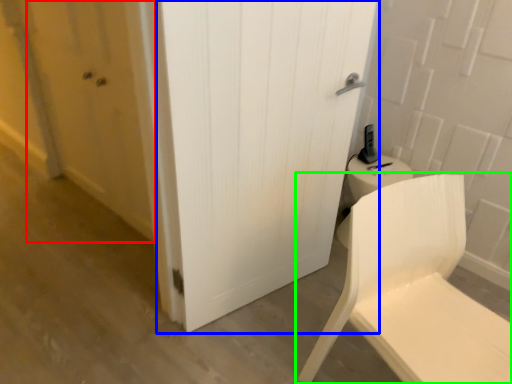
Question: Which object is the closest to the screen door (highlighted by a red box)? Choose among these: door (highlighted by a blue box) or chair (highlighted by a green box).

Choices:
 (A) door
 (B) chair

Answer: (A)